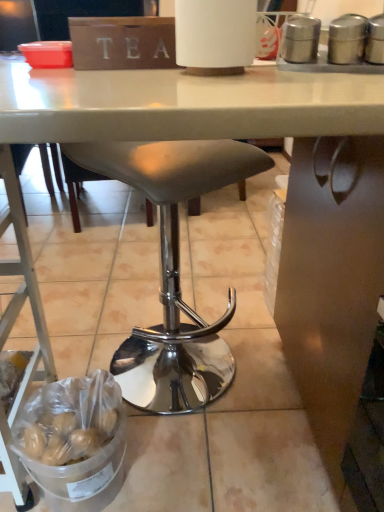
Identify the location of vacant space to the left of matte gray stool at center. Image resolution: width=384 pixels, height=512 pixels. (84, 328).